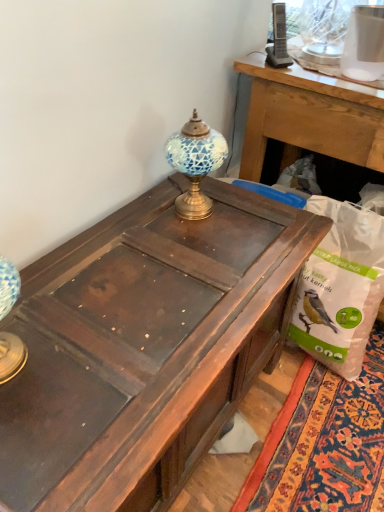
Question: Does white plastic bag at lower right have a greater height compared to blue mosaic glass at center?

Choices:
 (A) yes
 (B) no

Answer: (A)

Question: Is white plastic bag at lower right to the right of blue mosaic glass at center from the viewer's perspective?

Choices:
 (A) yes
 (B) no

Answer: (A)

Question: From a real-world perspective, is white plastic bag at lower right over blue mosaic glass at center?

Choices:
 (A) no
 (B) yes

Answer: (A)

Question: Can you confirm if white plastic bag at lower right is shorter than blue mosaic glass at center?

Choices:
 (A) yes
 (B) no

Answer: (B)

Question: From the image's perspective, is white plastic bag at lower right under blue mosaic glass at center?

Choices:
 (A) no
 (B) yes

Answer: (B)

Question: From a real-world perspective, is white plastic bag at lower right physically located above or below blue mosaic glass at center?

Choices:
 (A) above
 (B) below

Answer: (B)

Question: In the image, is white plastic bag at lower right positioned in front of or behind blue mosaic glass at center?

Choices:
 (A) front
 (B) behind

Answer: (B)

Question: Is white plastic bag at lower right wider or thinner than blue mosaic glass at center?

Choices:
 (A) thin
 (B) wide

Answer: (B)

Question: Considering the positions of white plastic bag at lower right and blue mosaic glass at center in the image, is white plastic bag at lower right taller or shorter than blue mosaic glass at center?

Choices:
 (A) short
 (B) tall

Answer: (B)

Question: In terms of size, does dark brown wood desk at center appear bigger or smaller than white plastic bag at lower right?

Choices:
 (A) small
 (B) big

Answer: (B)

Question: From their relative heights in the image, would you say dark brown wood desk at center is taller or shorter than white plastic bag at lower right?

Choices:
 (A) short
 (B) tall

Answer: (B)

Question: Considering their positions, is dark brown wood desk at center located in front of or behind white plastic bag at lower right?

Choices:
 (A) front
 (B) behind

Answer: (A)

Question: Would you say dark brown wood desk at center is to the left or to the right of white plastic bag at lower right in the picture?

Choices:
 (A) right
 (B) left

Answer: (B)

Question: Considering the positions of dark brown wood desk at center and blue mosaic glass at center in the image, is dark brown wood desk at center bigger or smaller than blue mosaic glass at center?

Choices:
 (A) small
 (B) big

Answer: (B)

Question: From the image's perspective, is dark brown wood desk at center positioned above or below blue mosaic glass at center?

Choices:
 (A) below
 (B) above

Answer: (A)